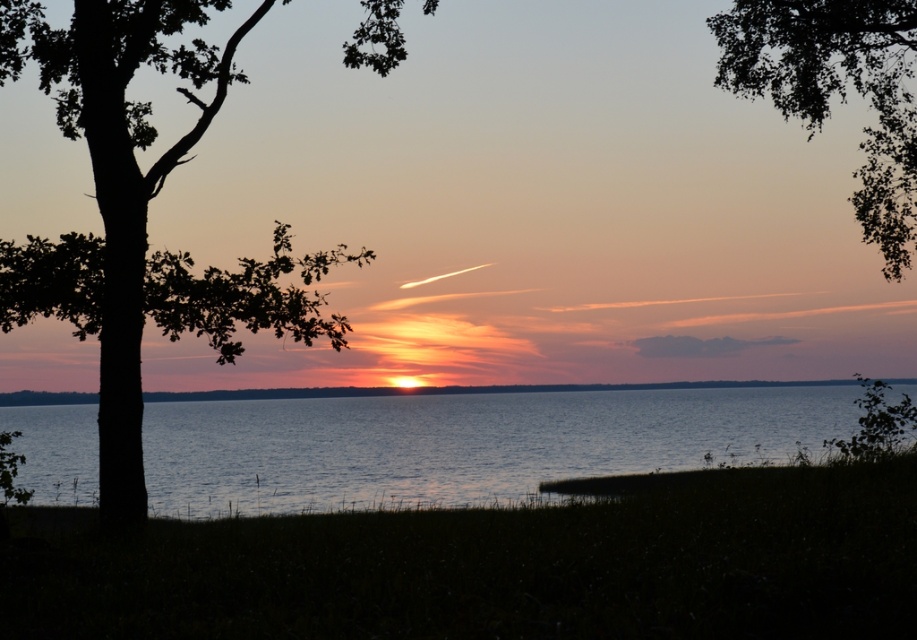
Question: Does green leafy tree at upper right have a larger size compared to smooth water at center?

Choices:
 (A) no
 (B) yes

Answer: (B)

Question: Which point appears farthest from the camera in this image?

Choices:
 (A) (506, 433)
 (B) (61, 262)
 (C) (750, 19)

Answer: (A)

Question: Which is nearer to the green leafy tree at upper right?

Choices:
 (A) blue water at center
 (B) black tree at left

Answer: (B)

Question: Estimate the real-world distances between objects in this image. Which object is farther from the blue water at center?

Choices:
 (A) black tree at left
 (B) smooth water at center
 (C) green leafy tree at upper right

Answer: (A)

Question: Does black tree at left appear under smooth water at center?

Choices:
 (A) yes
 (B) no

Answer: (B)

Question: Can you confirm if black tree at left is positioned below green leafy tree at upper right?

Choices:
 (A) yes
 (B) no

Answer: (A)